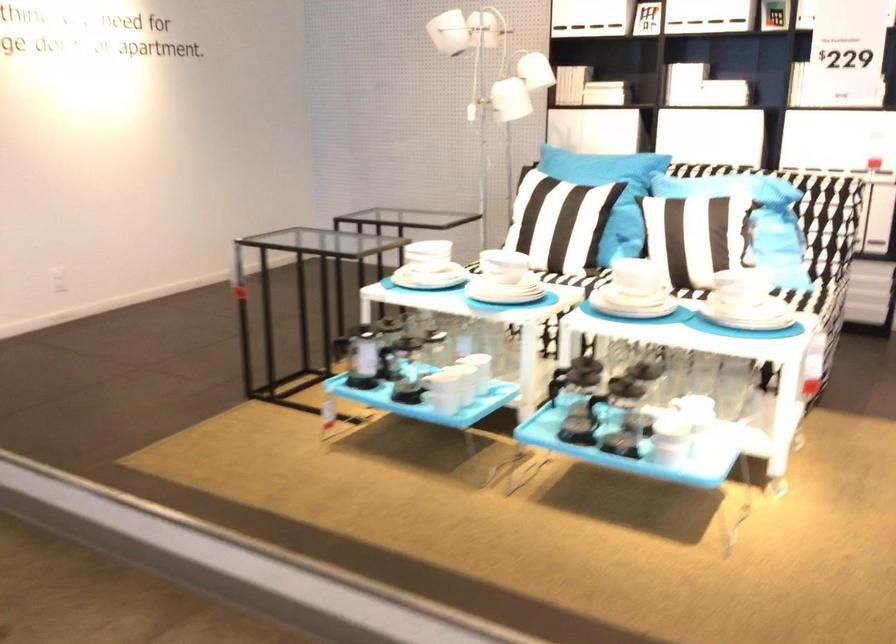
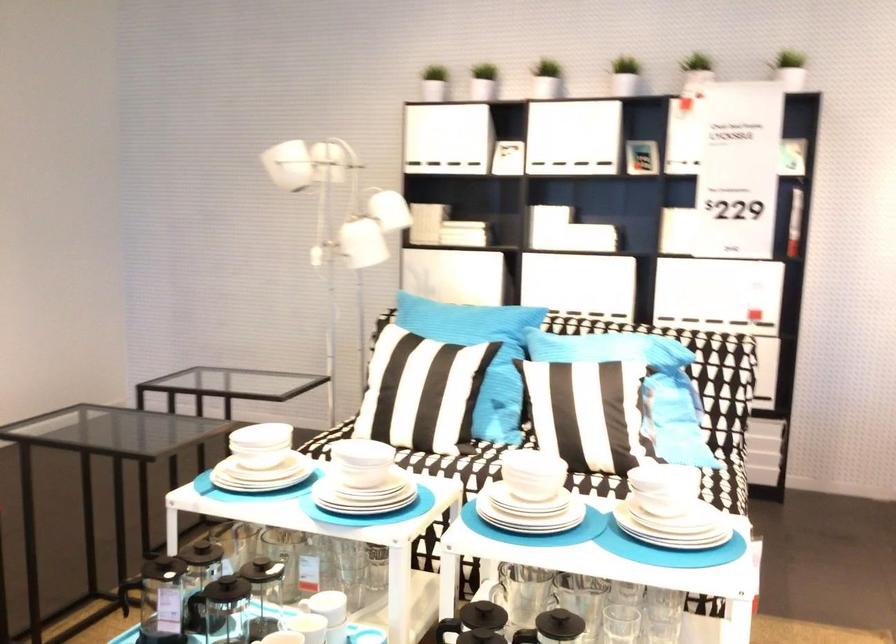
Locate, in the second image, the point that corresponds to the point at 742,278 in the first image.

(661, 489)